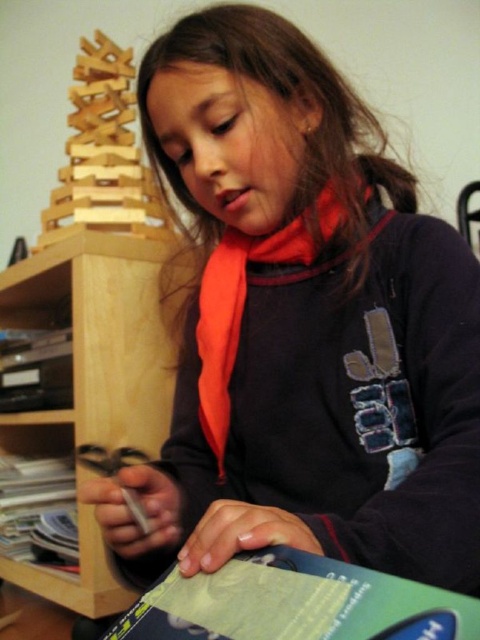
You are a child trying to stack the wooden blocks at upper left and the green matte book at lower left. Which object should you place at the bottom to make the stack stable?

You should place the wooden blocks at upper left at the bottom because they are taller than the green matte book at lower left, providing a more stable base.

In the scene shown: You are a parent organizing a playroom and want to place a toy car between the wooden bookshelf at left and the wooden blocks at upper left. Can you fit the toy car in the space between them if the toy car is 12 inches long?

The wooden bookshelf at left is 11.96 inches from wooden blocks at upper left. Since the toy car is 12 inches long, it won not fit in the space between them because the distance is slightly less than the car length.